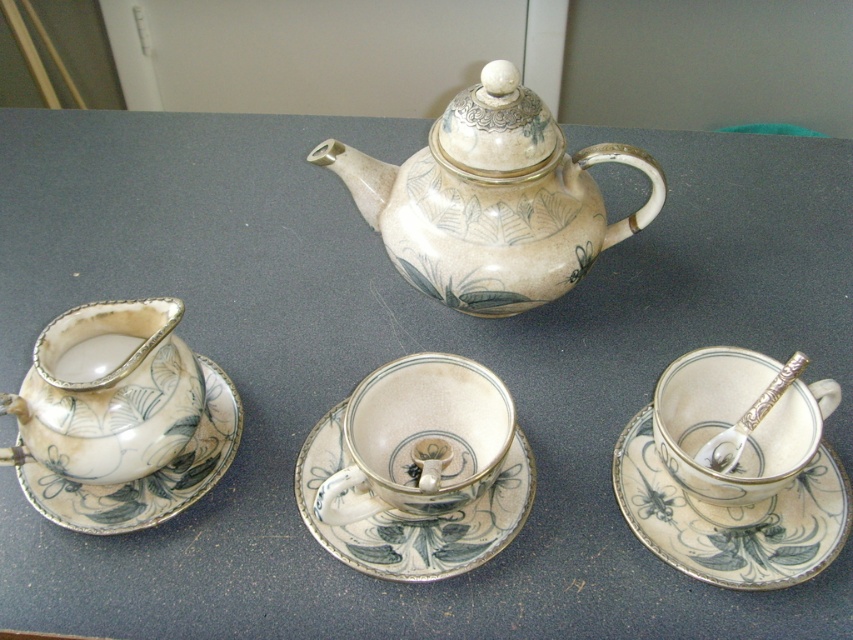
You are setting up a tea service and need to place a silver metallic spoon at right on the table. There is a porcelain saucer at center already there. Can the spoon fit on the saucer without hanging over the edges?

The porcelain saucer at center is larger in size than the silver metallic spoon at right, so the spoon can fit on the saucer without hanging over the edges.

You are arranging a tea set on a small table and need to place both the matte porcelain teacup at left and the white glossy teacup at center. Which teacup should you choose if you want to save more space?

The matte porcelain teacup at left occupies less space than the white glossy teacup at center, so choosing the matte porcelain teacup at left will save more space.